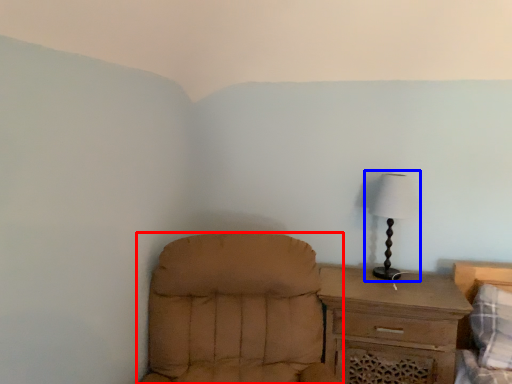
Question: Which of the following is the farthest to the observer, chair (highlighted by a red box) or lamp (highlighted by a blue box)?

Choices:
 (A) chair
 (B) lamp

Answer: (B)